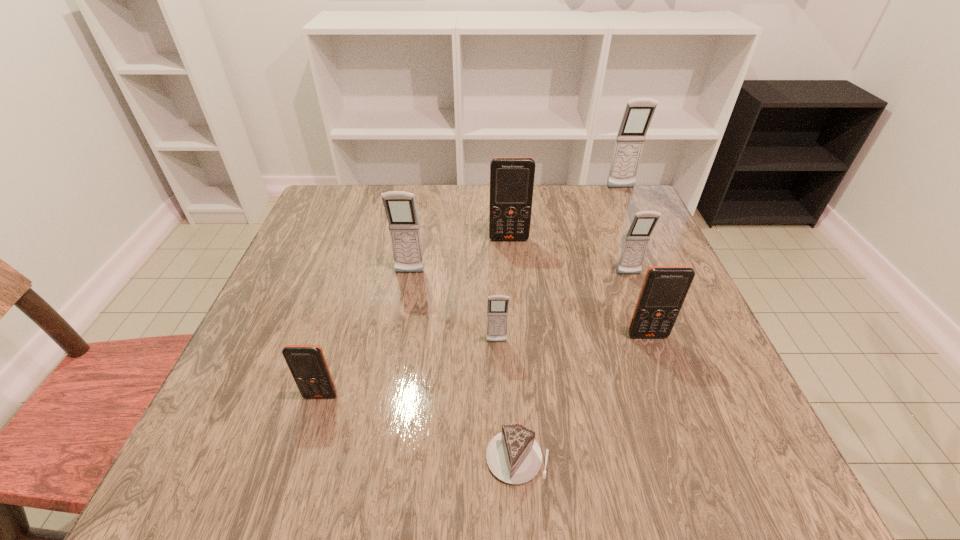
I want to click on vacant space at the right edge of the desktop, so click(x=651, y=249).

The image size is (960, 540). I want to click on vacant space at the far right corner of the desktop, so click(x=621, y=222).

The height and width of the screenshot is (540, 960). In order to click on free space at the near right corner in this screenshot , I will do `click(710, 486)`.

Find the location of a particular element. The height and width of the screenshot is (540, 960). empty space between the leftmost orange cellular telephone and the nearest gray cellular telephone is located at coordinates (409, 369).

You are a GUI agent. You are given a task and a screenshot of the screen. Output one action in this format:
    pyautogui.click(x=<x>, y=<y>)
    Task: Click on the vacant point located between the smallest gray cellular telephone and the rightmost orange cellular telephone
    This screenshot has height=540, width=960.
    Given the screenshot: What is the action you would take?
    pyautogui.click(x=572, y=339)

Locate an element on the screen. unoccupied area between the biggest orange cellular telephone and the shortest object is located at coordinates (514, 348).

The image size is (960, 540). Find the location of `empty space between the smallest orange cellular telephone and the rightmost object`. empty space between the smallest orange cellular telephone and the rightmost object is located at coordinates (470, 292).

Where is `vacant space that's between the rightmost object and the third gray cellular telephone from right to left`? Image resolution: width=960 pixels, height=540 pixels. vacant space that's between the rightmost object and the third gray cellular telephone from right to left is located at coordinates (559, 265).

You are a GUI agent. You are given a task and a screenshot of the screen. Output one action in this format:
    pyautogui.click(x=<x>, y=<y>)
    Task: Click on the unoccupied position between the rightmost object and the second gray cellular telephone from left to right
    
    Given the screenshot: What is the action you would take?
    pyautogui.click(x=559, y=265)

You are a GUI agent. You are given a task and a screenshot of the screen. Output one action in this format:
    pyautogui.click(x=<x>, y=<y>)
    Task: Click on the free space between the third smallest gray cellular telephone and the second smallest orange cellular telephone
    This screenshot has height=540, width=960.
    Given the screenshot: What is the action you would take?
    pyautogui.click(x=529, y=304)